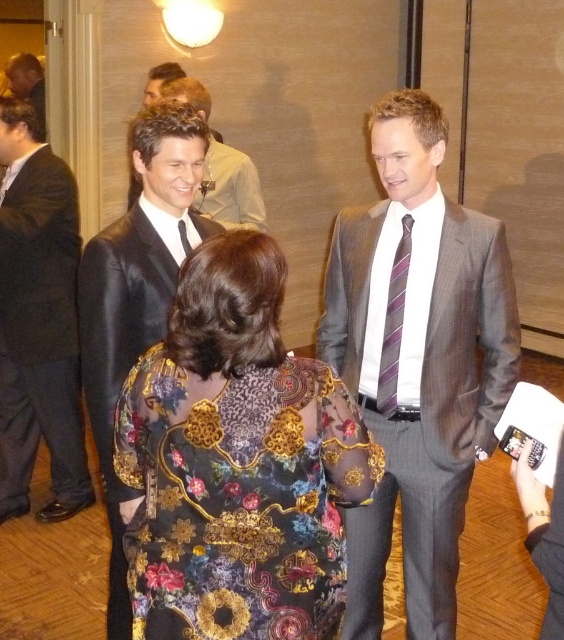
Question: Can you confirm if purple striped tie at center is smaller than matte black tie at center?

Choices:
 (A) yes
 (B) no

Answer: (B)

Question: Which is farther from the floral-patterned sheer blouse at center?

Choices:
 (A) matte black suit at center
 (B) purple striped tie at center
 (C) gray textured suit at center

Answer: (A)

Question: Which point is farther from the camera taking this photo?

Choices:
 (A) (288, 444)
 (B) (65, 483)
 (C) (180, 145)
 (D) (395, 250)

Answer: (B)

Question: Does gray textured suit at center come behind matte black tie at center?

Choices:
 (A) yes
 (B) no

Answer: (B)

Question: Is shiny black suit at center bigger than matte black suit at upper left?

Choices:
 (A) no
 (B) yes

Answer: (B)

Question: Which point is closer to the camera?

Choices:
 (A) purple striped tie at center
 (B) shiny black suit at left
 (C) shiny black suit at center
 (D) floral-patterned sheer blouse at center

Answer: (D)